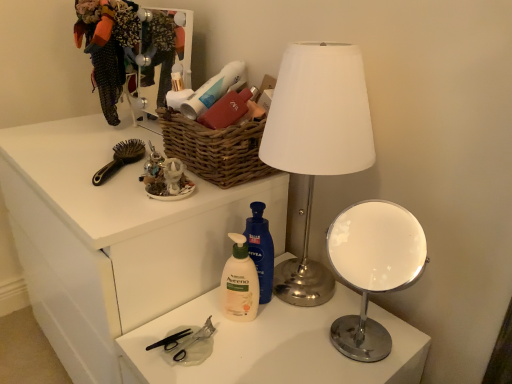
The height and width of the screenshot is (384, 512). What are the coordinates of `vacant space to the left of woven brown basket at upper center` in the screenshot? It's located at (102, 174).